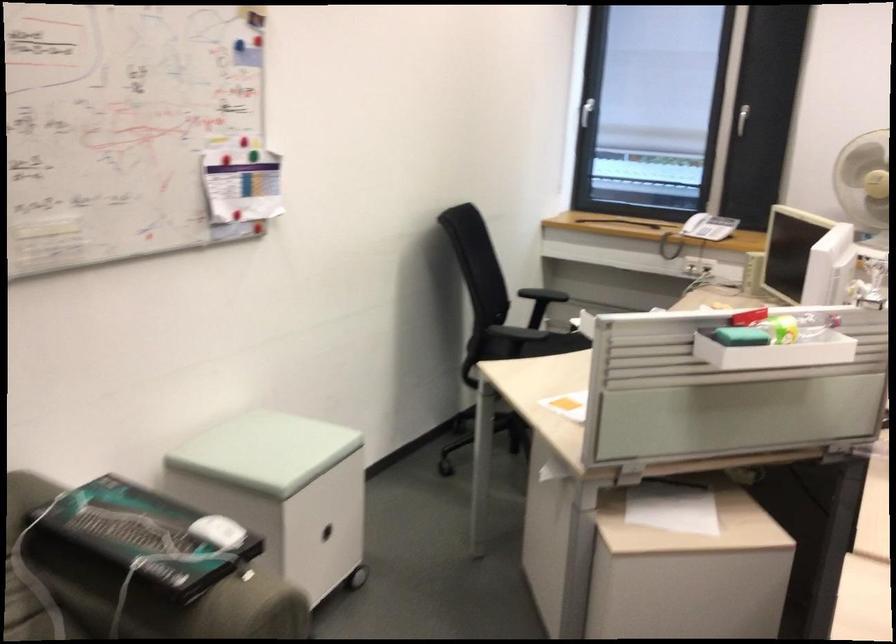
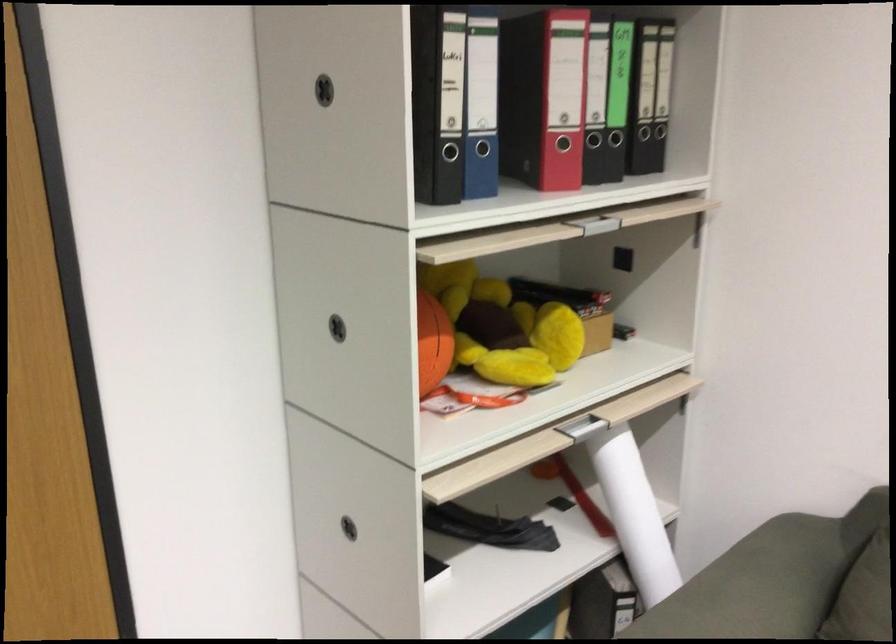
How did the camera likely rotate?

The camera's rotation is toward left-down.